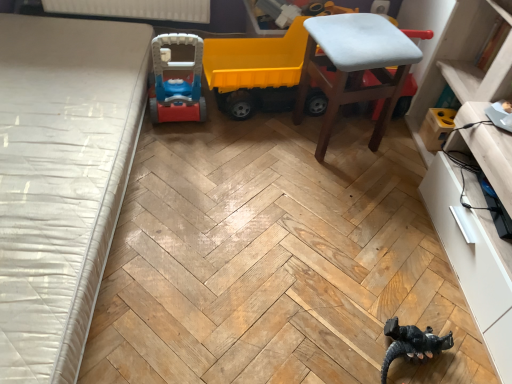
You are a GUI agent. You are given a task and a screenshot of the screen. Output one action in this format:
    pyautogui.click(x=<x>, y=<y>)
    Task: Click on the free spot below black matte toy dinosaur at lower right (from a real-world perspective)
    
    Given the screenshot: What is the action you would take?
    pyautogui.click(x=414, y=359)